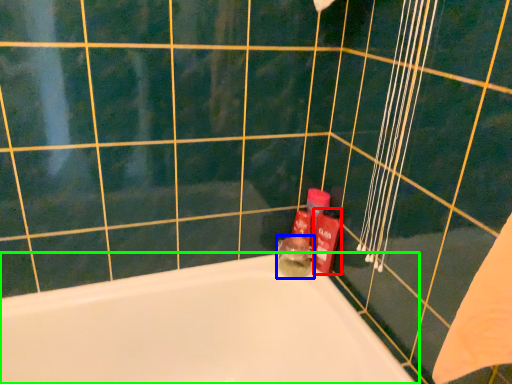
Question: Based on their relative distances, which object is farther from toiletry (highlighted by a red box)? Choose from toiletry (highlighted by a blue box) and bathtub (highlighted by a green box).

Choices:
 (A) toiletry
 (B) bathtub

Answer: (B)